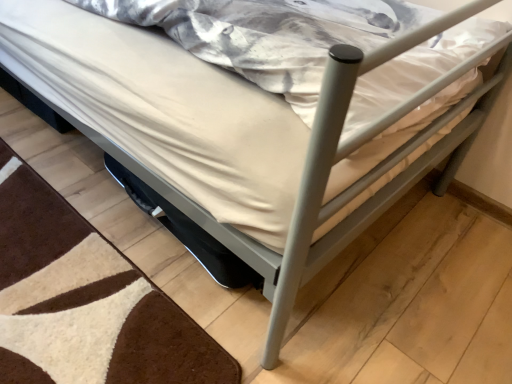
What do you see at coordinates (89, 301) in the screenshot? I see `brown textured mat at lower left` at bounding box center [89, 301].

Locate an element on the screen. Image resolution: width=512 pixels, height=384 pixels. brown textured mat at lower left is located at coordinates (89, 301).

In order to face brown textured mat at lower left, should I rotate leftwards or rightwards?

It's best to rotate left around 27.419 degrees.

At what (x,y) coordinates should I click in order to perform the action: click on brown textured mat at lower left. Please return your answer as a coordinate pair (x, y). Looking at the image, I should click on (89, 301).